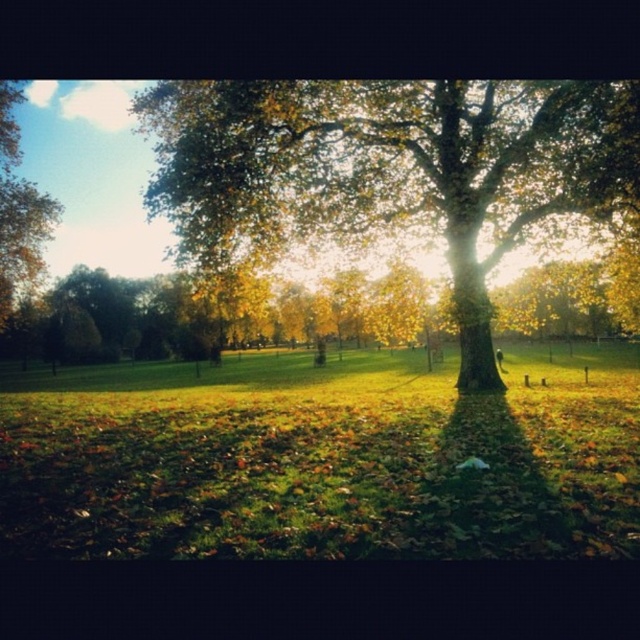
Question: Which point is farther to the camera?

Choices:
 (A) (20, 278)
 (B) (493, 198)
 (C) (269, 465)

Answer: (A)

Question: Among these points, which one is nearest to the camera?

Choices:
 (A) (394, 429)
 (B) (33, 257)

Answer: (A)

Question: Which of the following is the closest to the observer?

Choices:
 (A) golden textured tree at center
 (B) green grass at center
 (C) green leafy tree at upper left

Answer: (B)

Question: Is green grass at center above golden textured tree at center?

Choices:
 (A) no
 (B) yes

Answer: (A)

Question: Can you confirm if golden textured tree at center is positioned below green leafy tree at upper left?

Choices:
 (A) yes
 (B) no

Answer: (A)

Question: Does golden textured tree at center come behind green leafy tree at upper left?

Choices:
 (A) no
 (B) yes

Answer: (A)